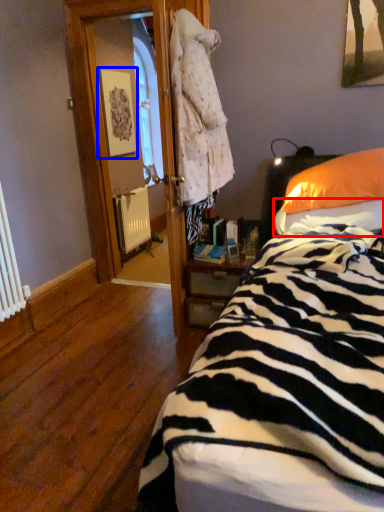
Question: Which object is further to the camera taking this photo, sheet (highlighted by a red box) or picture frame (highlighted by a blue box)?

Choices:
 (A) sheet
 (B) picture frame

Answer: (B)